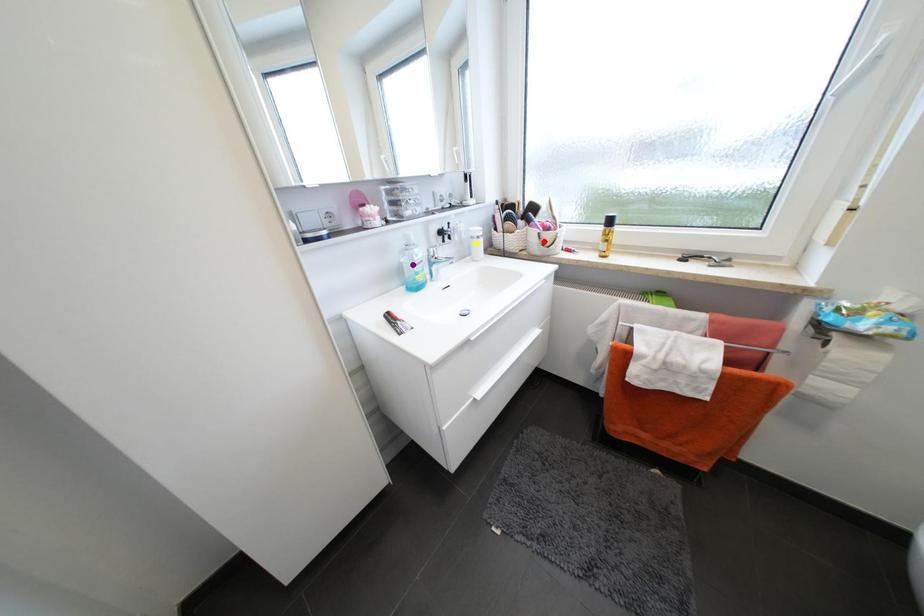
Order these from nearest to farthest:
yellow point | red point | purple point

1. purple point
2. yellow point
3. red point